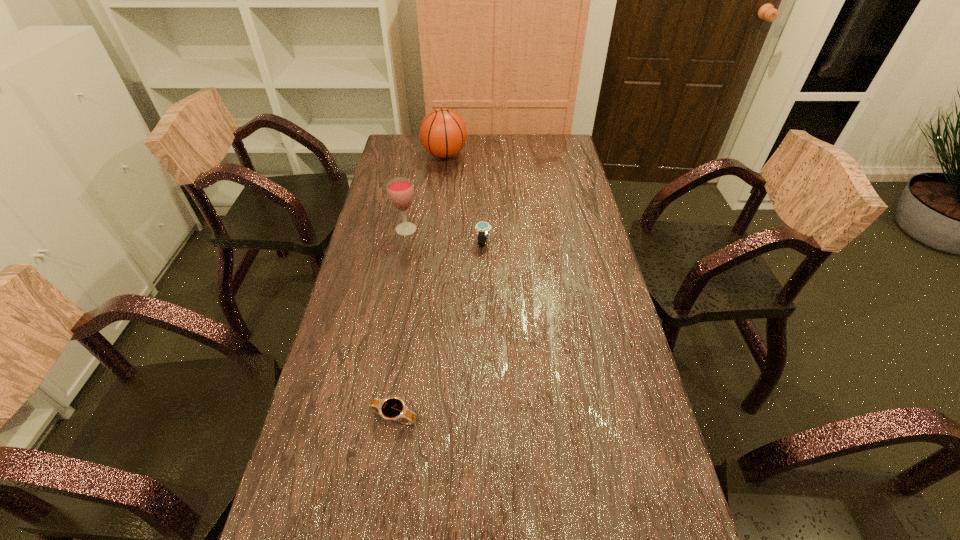
What are the coordinates of `the farthest object` in the screenshot? It's located at (443, 133).

I want to click on wineglass, so click(x=400, y=190).

The width and height of the screenshot is (960, 540). Find the location of `the third tallest object`. the third tallest object is located at coordinates (482, 228).

You are a GUI agent. You are given a task and a screenshot of the screen. Output one action in this format:
    pyautogui.click(x=<x>, y=<y>)
    Task: Click on the rightmost object
    The image size is (960, 540).
    Given the screenshot: What is the action you would take?
    point(482,228)

This screenshot has width=960, height=540. I want to click on the shorter watch, so click(x=391, y=408).

Find the location of a particular element. The width and height of the screenshot is (960, 540). the left watch is located at coordinates (391, 408).

You are a GUI agent. You are given a task and a screenshot of the screen. Output one action in this format:
    pyautogui.click(x=<x>, y=<y>)
    Task: Click on the free space located on the front of the basketball
    
    Given the screenshot: What is the action you would take?
    pyautogui.click(x=437, y=227)

Locate an element on the screen. vacant space positioned 0.250m on the front of the wineglass is located at coordinates (395, 292).

This screenshot has width=960, height=540. I want to click on vacant space located 0.290m on the right of the right watch, so click(x=579, y=242).

The image size is (960, 540). Identify the location of vacant area situated on the back of the shortest object. (398, 386).